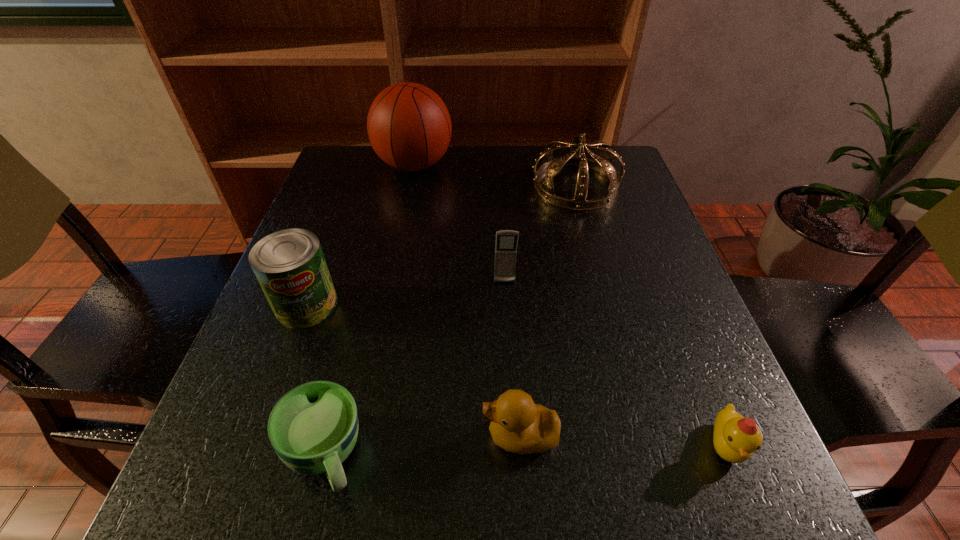
Locate an element on the screen. The width and height of the screenshot is (960, 540). basketball is located at coordinates (409, 127).

At what (x,y) coordinates should I click in order to perform the action: click on tiara. Please return your answer as a coordinate pair (x, y). The width and height of the screenshot is (960, 540). Looking at the image, I should click on (602, 163).

You are a GUI agent. You are given a task and a screenshot of the screen. Output one action in this format:
    pyautogui.click(x=<x>, y=<y>)
    Task: Click on the can
    This screenshot has height=540, width=960.
    Given the screenshot: What is the action you would take?
    pyautogui.click(x=290, y=266)

What are the coordinates of `cellular telephone` in the screenshot? It's located at (506, 240).

Locate an element on the screen. The image size is (960, 540). the left duckling is located at coordinates (518, 425).

Find the location of a particular element. This screenshot has height=540, width=960. the right duckling is located at coordinates (735, 438).

Where is `cup`? The image size is (960, 540). cup is located at coordinates (313, 428).

This screenshot has width=960, height=540. I want to click on vacant position located on the front of the tallest object, so click(402, 227).

The image size is (960, 540). Find the location of `free space located 0.070m on the left of the tiara`. free space located 0.070m on the left of the tiara is located at coordinates (504, 186).

Find the location of a particular element. The height and width of the screenshot is (540, 960). free space located on the right of the can is located at coordinates (420, 305).